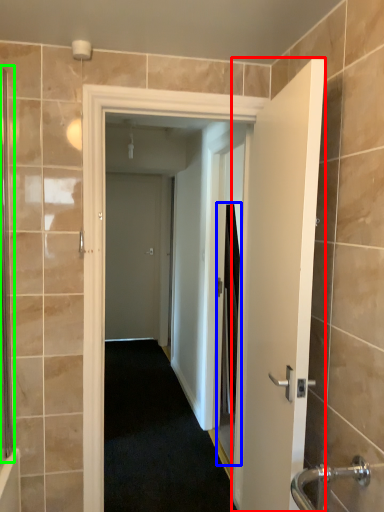
Question: Which object is positioned closest to door (highlighted by a red box)? Select from screen door (highlighted by a blue box) and screen door (highlighted by a green box).

Choices:
 (A) screen door
 (B) screen door

Answer: (B)